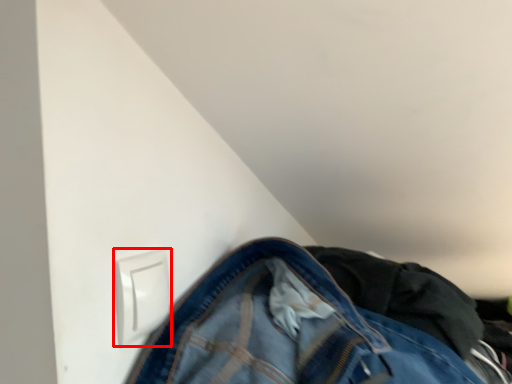
Question: From the image's perspective, considering the relative positions of electric outlet (annotated by the red box) and trousers in the image provided, where is electric outlet (annotated by the red box) located with respect to the staircase?

Choices:
 (A) below
 (B) above

Answer: (B)